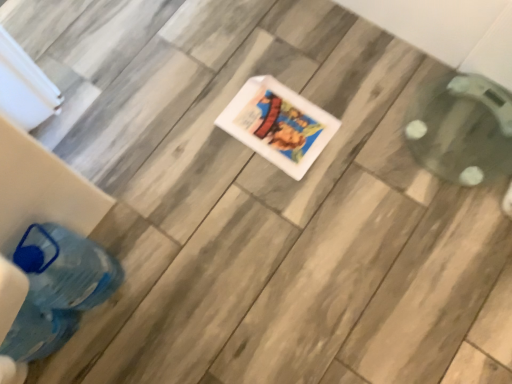
In order to click on vacant area that lies to the right of blue plastic bottle at lower left in this screenshot , I will do `click(168, 277)`.